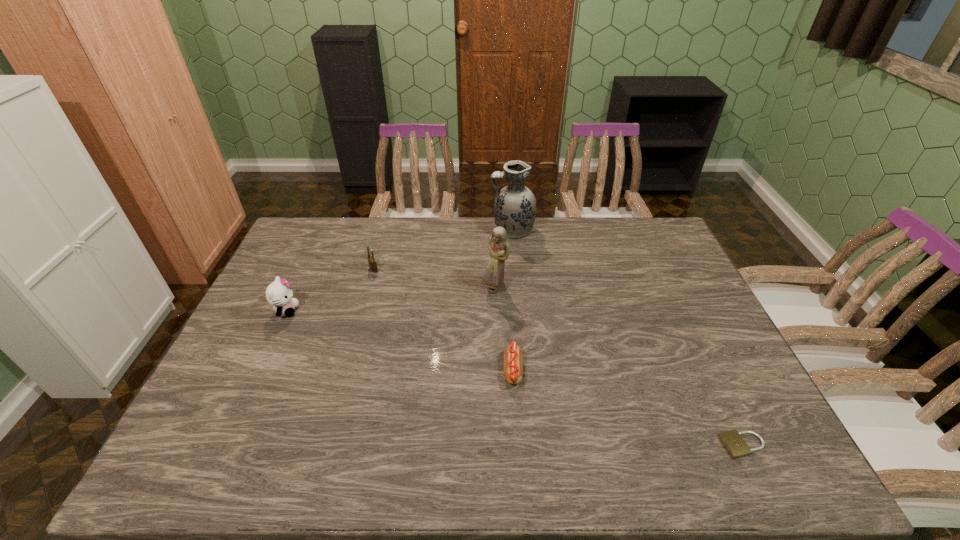
At what (x,y) coordinates should I click in order to perform the action: click on object present at the left edge. Please return your answer as a coordinate pair (x, y). The image size is (960, 540). Looking at the image, I should click on (279, 294).

Find the location of a particular element. Image resolution: width=960 pixels, height=540 pixels. object situated at the right edge is located at coordinates (733, 442).

Locate an element on the screen. Image resolution: width=960 pixels, height=540 pixels. object that is at the near right corner is located at coordinates (733, 442).

You are a GUI agent. You are given a task and a screenshot of the screen. Output one action in this format:
    pyautogui.click(x=<x>, y=<y>)
    Task: Click on the vacant region at the far edge
    Image resolution: width=960 pixels, height=540 pixels.
    Given the screenshot: What is the action you would take?
    pyautogui.click(x=563, y=247)

The width and height of the screenshot is (960, 540). In the image, there is a desktop. In order to click on vacant space at the near edge in this screenshot , I will do `click(684, 453)`.

Identify the location of free space at the left edge of the desktop. (239, 437).

The width and height of the screenshot is (960, 540). Find the location of `free region at the right edge`. free region at the right edge is located at coordinates (693, 322).

In the image, there is a desktop. Where is `vacant space at the far right corner`? vacant space at the far right corner is located at coordinates (642, 218).

Image resolution: width=960 pixels, height=540 pixels. In order to click on free space between the vase and the second object from left to right in this screenshot , I will do `click(443, 249)`.

Locate an element on the screen. This screenshot has width=960, height=540. empty space between the fifth object from right to left and the fifth tallest object is located at coordinates (444, 320).